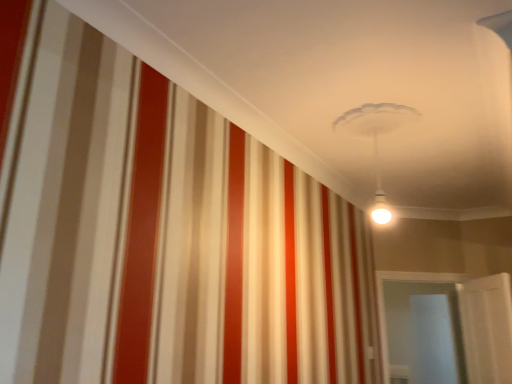
Question: Does white glossy door at lower right have a greater width compared to transparent glass door at lower right?

Choices:
 (A) no
 (B) yes

Answer: (A)

Question: From a real-world perspective, is white glossy door at lower right over transparent glass door at lower right?

Choices:
 (A) no
 (B) yes

Answer: (A)

Question: Does white glossy door at lower right have a smaller size compared to transparent glass door at lower right?

Choices:
 (A) no
 (B) yes

Answer: (B)

Question: Can you confirm if white glossy door at lower right is bigger than transparent glass door at lower right?

Choices:
 (A) no
 (B) yes

Answer: (A)

Question: Does white glossy door at lower right turn towards transparent glass door at lower right?

Choices:
 (A) yes
 (B) no

Answer: (A)

Question: Is white glossy door at lower right outside transparent glass door at lower right?

Choices:
 (A) yes
 (B) no

Answer: (A)

Question: Is transparent glass door at lower right aimed at white glossy door at lower right?

Choices:
 (A) no
 (B) yes

Answer: (B)

Question: Is transparent glass door at lower right completely or partially outside of white glossy door at lower right?

Choices:
 (A) yes
 (B) no

Answer: (A)

Question: Does transparent glass door at lower right have a smaller size compared to white glossy door at lower right?

Choices:
 (A) yes
 (B) no

Answer: (B)

Question: Does transparent glass door at lower right have a greater width compared to white glossy door at lower right?

Choices:
 (A) yes
 (B) no

Answer: (A)

Question: Are transparent glass door at lower right and white glossy door at lower right beside each other?

Choices:
 (A) yes
 (B) no

Answer: (B)

Question: Is transparent glass door at lower right further to camera compared to white glossy door at lower right?

Choices:
 (A) yes
 (B) no

Answer: (A)

Question: Is point (391, 367) positioned closer to the camera than point (475, 377)?

Choices:
 (A) closer
 (B) farther

Answer: (B)